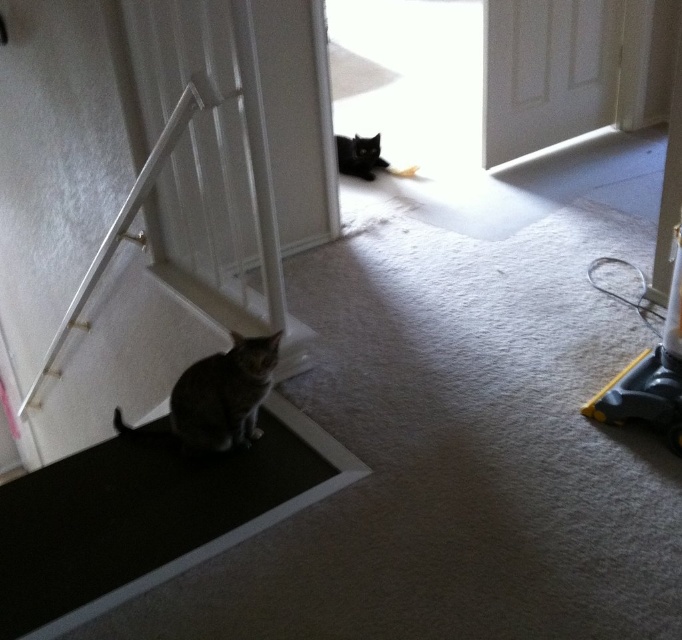
Which is more to the right, white glossy door at upper center or gray striped cat at lower left?

From the viewer's perspective, white glossy door at upper center appears more on the right side.

Who is higher up, white glossy door at upper center or gray striped cat at lower left?

white glossy door at upper center

Where is `white glossy door at upper center`? The image size is (682, 640). white glossy door at upper center is located at coordinates (546, 72).

Which is behind, point (38, 550) or point (514, 60)?

Point (514, 60)

This screenshot has width=682, height=640. I want to click on dark gray rubber doormat at lower left, so click(x=147, y=516).

Between dark gray rubber doormat at lower left and black glossy cat at upper center, which one has less height?

With less height is black glossy cat at upper center.

Between point (188, 528) and point (353, 150), which one is positioned in front?

Point (188, 528) is in front.

The height and width of the screenshot is (640, 682). In order to click on dark gray rubber doormat at lower left in this screenshot , I will do `click(147, 516)`.